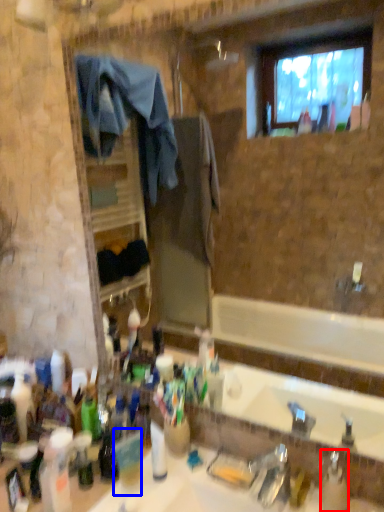
Question: Which object appears closest to the camera in this image, bottle (highlighted by a red box) or coffee cup (highlighted by a blue box)?

Choices:
 (A) bottle
 (B) coffee cup

Answer: (A)